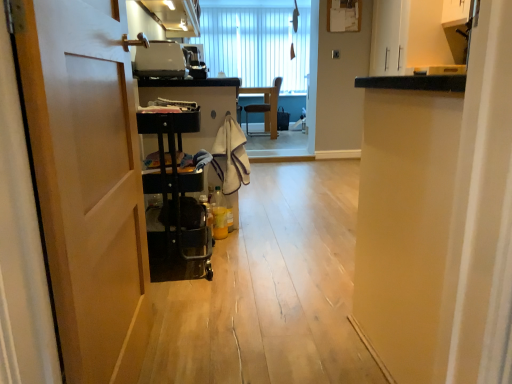
Question: Is beige textured towel at center a part of wooden chair at center?

Choices:
 (A) yes
 (B) no

Answer: (B)

Question: Does wooden chair at center come behind beige textured towel at center?

Choices:
 (A) no
 (B) yes

Answer: (B)

Question: From the image's perspective, does wooden chair at center appear higher than beige textured towel at center?

Choices:
 (A) yes
 (B) no

Answer: (A)

Question: Is wooden chair at center in contact with beige textured towel at center?

Choices:
 (A) no
 (B) yes

Answer: (A)

Question: Is wooden chair at center positioned in front of beige textured towel at center?

Choices:
 (A) no
 (B) yes

Answer: (A)

Question: Is wooden chair at center inside or outside of white vertical blinds at upper center?

Choices:
 (A) inside
 (B) outside

Answer: (B)

Question: Visually, is wooden chair at center positioned to the left or to the right of white vertical blinds at upper center?

Choices:
 (A) right
 (B) left

Answer: (A)

Question: Relative to white vertical blinds at upper center, is wooden chair at center in front or behind?

Choices:
 (A) front
 (B) behind

Answer: (A)

Question: From the image's perspective, is wooden chair at center above or below white vertical blinds at upper center?

Choices:
 (A) below
 (B) above

Answer: (A)

Question: From the image's perspective, is matte white cabinet at upper center positioned above or below wooden chair at center?

Choices:
 (A) below
 (B) above

Answer: (B)

Question: Is matte white cabinet at upper center in front of or behind wooden chair at center in the image?

Choices:
 (A) behind
 (B) front

Answer: (B)

Question: Is matte white cabinet at upper center bigger or smaller than wooden chair at center?

Choices:
 (A) small
 (B) big

Answer: (B)

Question: Considering the positions of point (163, 18) and point (276, 96), is point (163, 18) closer or farther from the camera than point (276, 96)?

Choices:
 (A) farther
 (B) closer

Answer: (B)

Question: In the image, is white vertical blinds at upper center positioned in front of or behind black plastic cart at left?

Choices:
 (A) front
 (B) behind

Answer: (B)

Question: Would you say white vertical blinds at upper center is to the left or to the right of black plastic cart at left in the picture?

Choices:
 (A) left
 (B) right

Answer: (B)